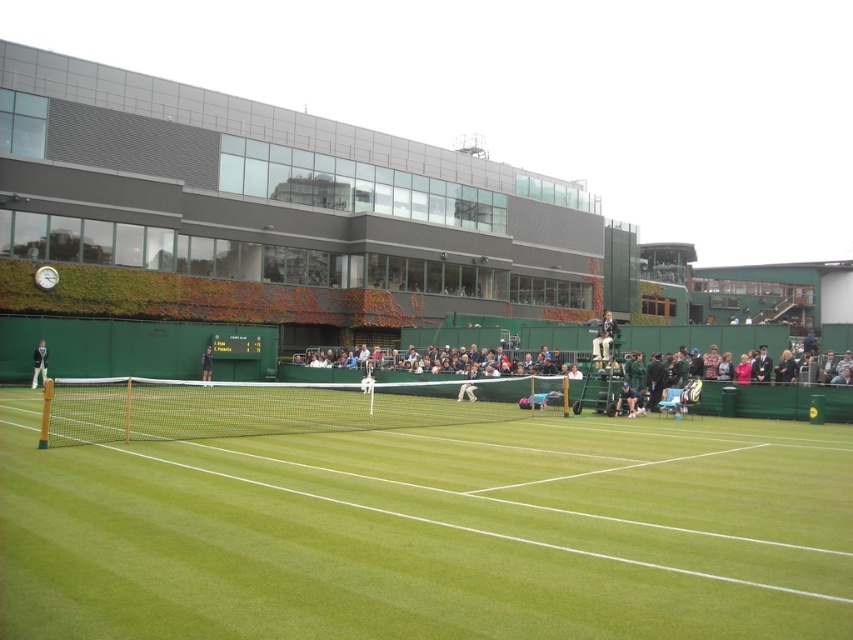
Question: Is light blue fabric chair at center bigger than green fabric chair at center?

Choices:
 (A) no
 (B) yes

Answer: (B)

Question: Among these points, which one is farthest from the camera?

Choices:
 (A) (633, 388)
 (B) (407, 556)

Answer: (A)

Question: Can you confirm if light blue fabric chair at center is positioned to the right of dark blue suit at left?

Choices:
 (A) no
 (B) yes

Answer: (B)

Question: Does green fabric chair at center have a larger size compared to dark blue shirt at center?

Choices:
 (A) no
 (B) yes

Answer: (A)

Question: Which point is farther to the camera?

Choices:
 (A) (465, 385)
 (B) (212, 349)
 (C) (612, 317)

Answer: (C)

Question: Based on their relative distances, which object is nearer to the green grass tennis court at center?

Choices:
 (A) white fabric tennis player at center
 (B) dark blue shirt at center

Answer: (A)